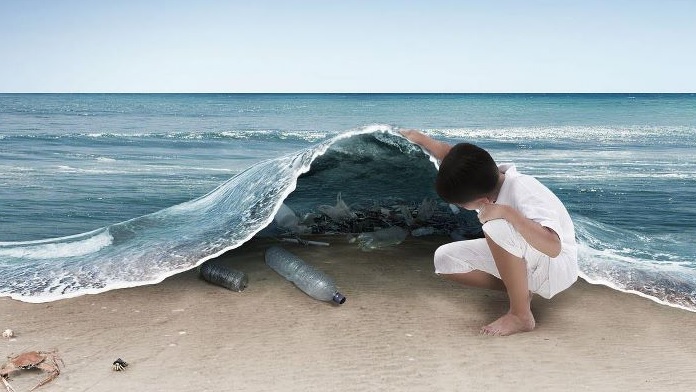
Locate an element on the screen. This screenshot has height=392, width=696. bottle is located at coordinates (319, 309), (319, 297).